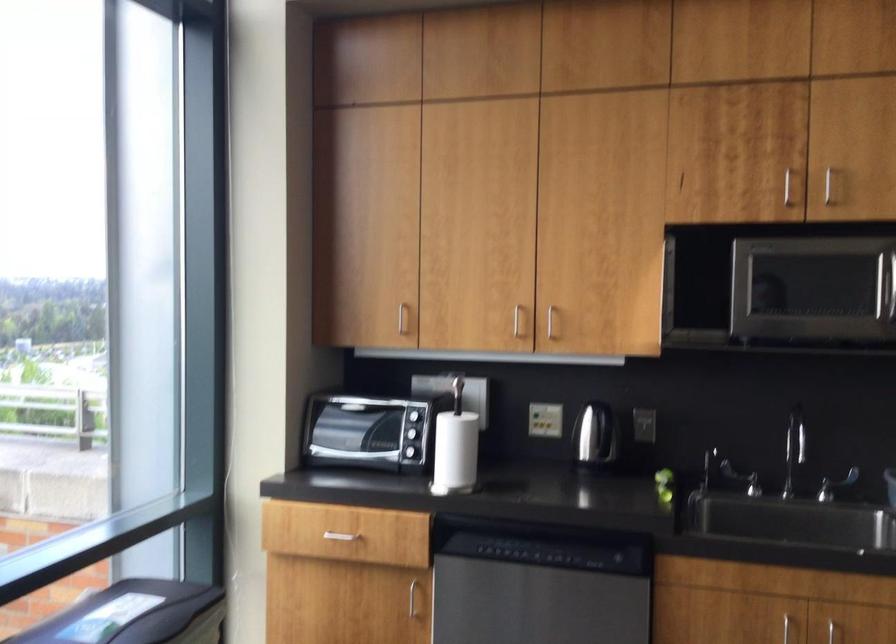
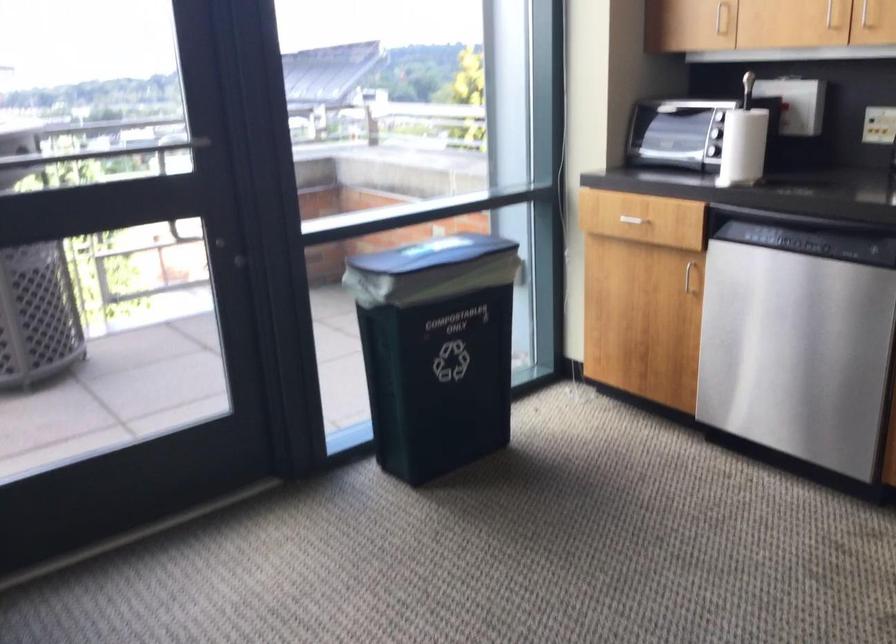
The point at (461, 451) is marked in the first image. Where is the corresponding point in the second image?

(743, 146)